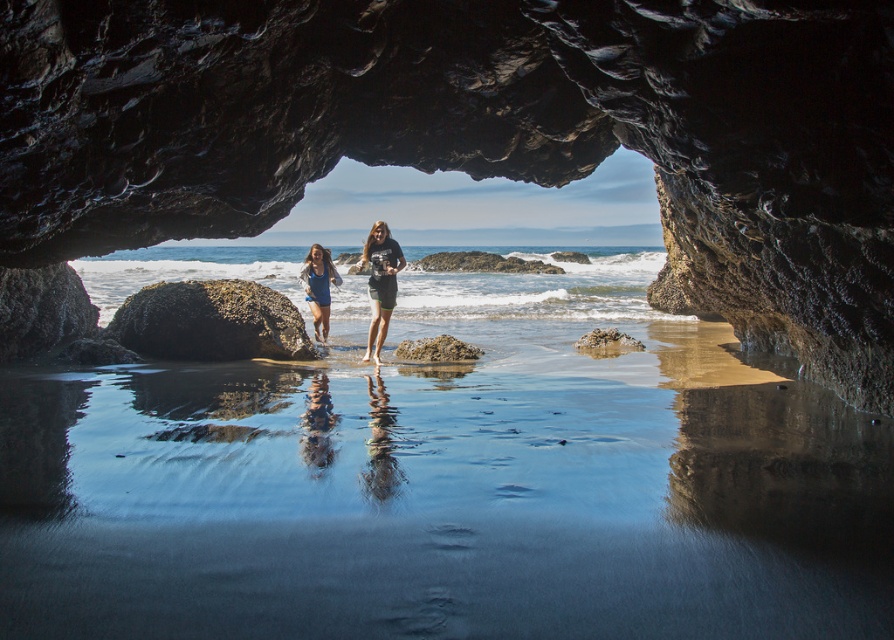
From the picture: You are standing inside the cave and want to take a photo of both the smooth dark rock at center and the matte blue dress at center. Which object should you focus on first to ensure both are in frame?

You should focus on the smooth dark rock at center first because it is taller than the matte blue dress at center, so adjusting the camera angle to include its full height will naturally include the shorter matte blue dress at center in the frame.

You are standing inside the cave looking out towards the ocean. You see two points marked on the beach. The first point is at coordinate point(844,198) and the second is at point(372,305). Which point is closer to you, the observer, inside the cave?

Point(844,198) is in front of point(372,305), so it is closer to you inside the cave.